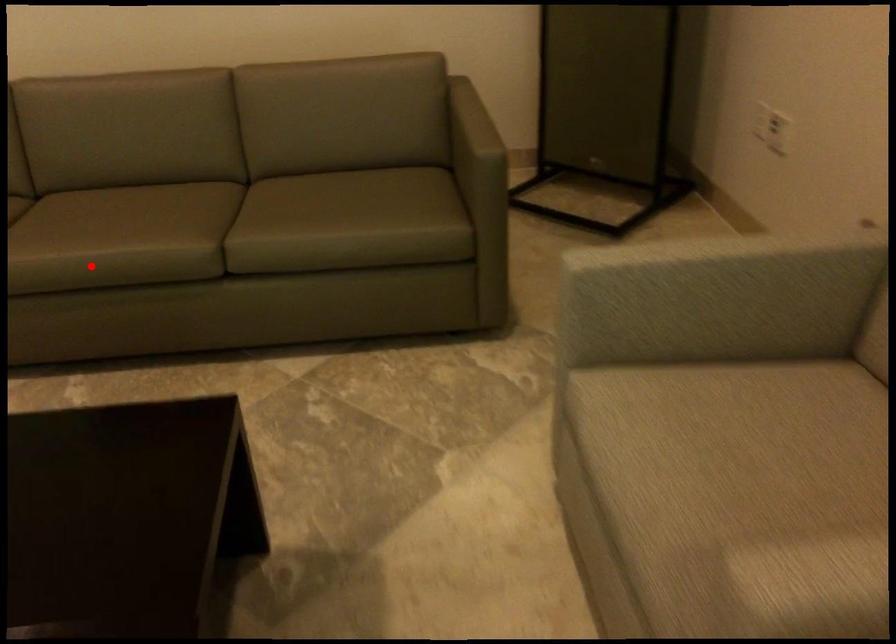
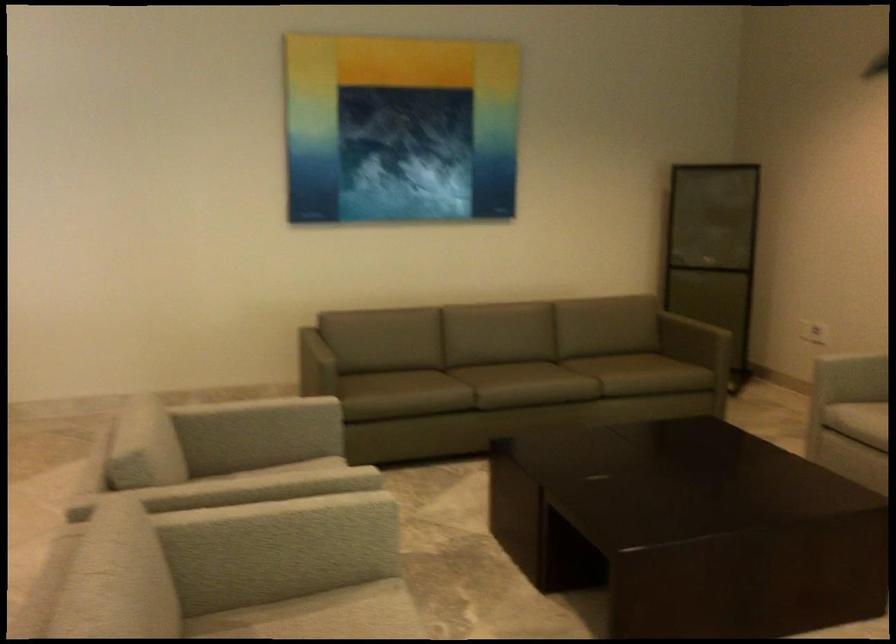
Question: A red point is marked in image1. In image2, is the corresponding 3D point closer to the camera or farther? Reply with the corresponding letter.

Choices:
 (A) The corresponding 3D point is closer.
 (B) The corresponding 3D point is farther.

Answer: (B)